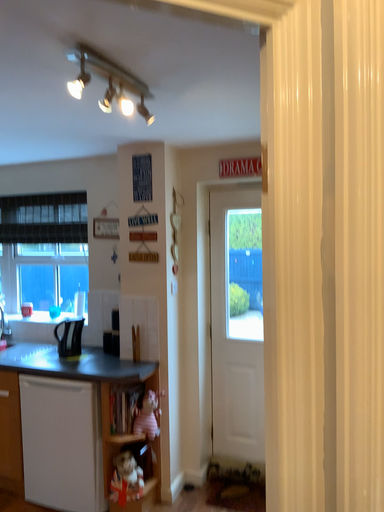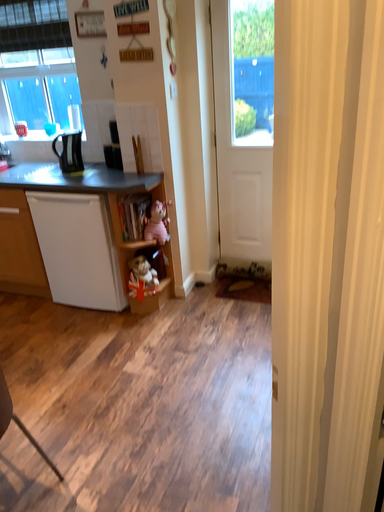
Question: Which way did the camera rotate in the video?

Choices:
 (A) rotated downward
 (B) rotated upward

Answer: (A)